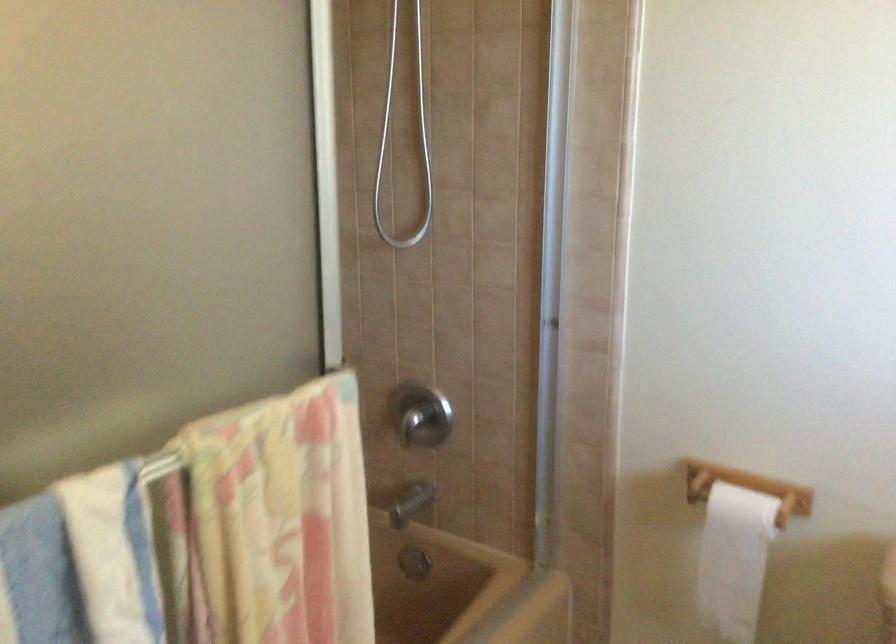
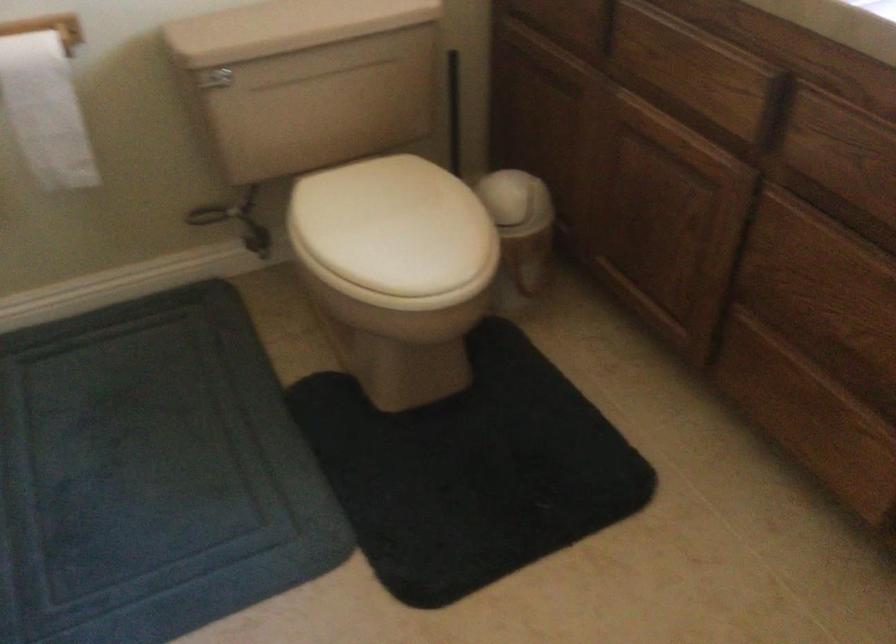
First-person continuous shooting, in which direction is the camera rotating?

The camera's rotation is toward right-down.